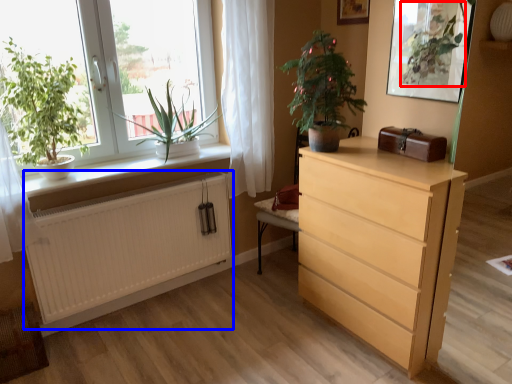
Question: Which object is closer to the camera taking this photo, vegetation (highlighted by a red box) or radiator (highlighted by a blue box)?

Choices:
 (A) vegetation
 (B) radiator

Answer: (A)